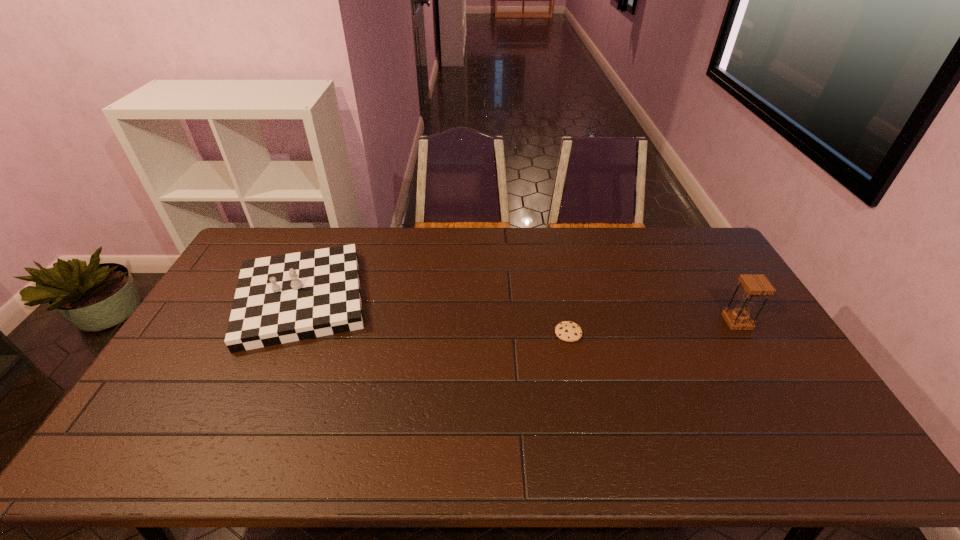
Where is `unoccupied area between the rightmost object and the checkerboard`? The width and height of the screenshot is (960, 540). unoccupied area between the rightmost object and the checkerboard is located at coordinates (519, 310).

Where is `free space between the rightmost object and the second object from right to left`? This screenshot has width=960, height=540. free space between the rightmost object and the second object from right to left is located at coordinates (653, 327).

Where is `empty location between the tallest object and the checkerboard`? Image resolution: width=960 pixels, height=540 pixels. empty location between the tallest object and the checkerboard is located at coordinates (519, 310).

The image size is (960, 540). In order to click on free spot between the checkerboard and the second object from left to right in this screenshot , I will do `click(435, 316)`.

Where is `free space between the second object from right to left and the checkerboard`? The width and height of the screenshot is (960, 540). free space between the second object from right to left and the checkerboard is located at coordinates (435, 316).

Where is `empty location between the checkerboard and the tallest object`? Image resolution: width=960 pixels, height=540 pixels. empty location between the checkerboard and the tallest object is located at coordinates (519, 310).

I want to click on free point between the shortest object and the second shortest object, so click(435, 316).

Image resolution: width=960 pixels, height=540 pixels. I want to click on empty space that is in between the checkerboard and the second object from left to right, so click(x=435, y=316).

Find the location of `object that ranks as the second closest to the tallest object`. object that ranks as the second closest to the tallest object is located at coordinates (279, 299).

Point out which object is positioned as the second nearest to the hourglass. Please provide its 2D coordinates. Your answer should be formatted as a tuple, i.e. [(x, y)], where the tuple contains the x and y coordinates of a point satisfying the conditions above.

[(279, 299)]